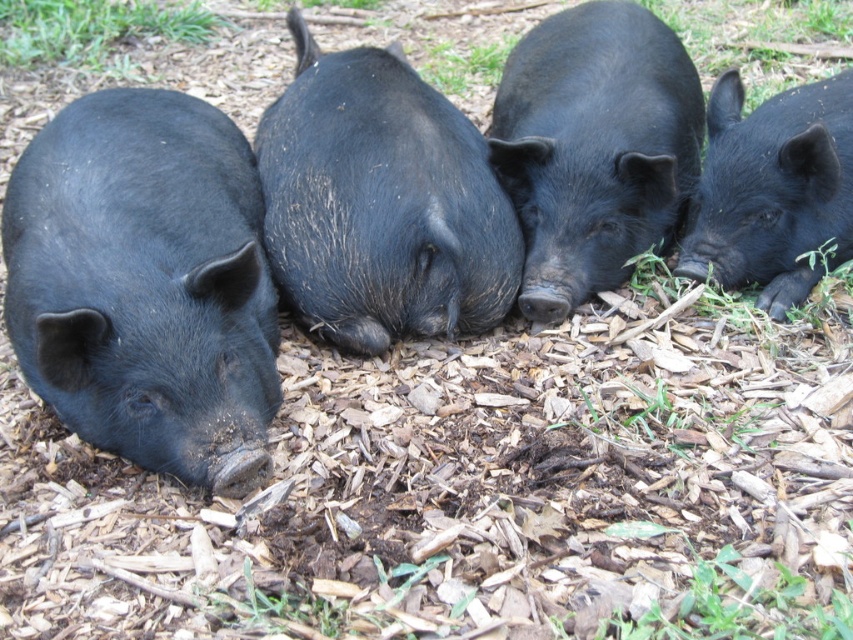
Is matte black pig at left smaller than black rough skin pig at center?

Yes.

Does point (35, 163) come in front of point (360, 241)?

Yes, point (35, 163) is closer to viewer.

This screenshot has height=640, width=853. Find the location of `matte black pig at left`. matte black pig at left is located at coordinates (146, 284).

Does black rough skin pig at center appear on the left side of black matte pig at right?

Indeed, black rough skin pig at center is positioned on the left side of black matte pig at right.

Between point (392, 224) and point (805, 154), which one is positioned in front?

Point (392, 224)

Is point (402, 211) positioned after point (756, 147)?

No, it is in front of (756, 147).

Find the location of a particular element. The image size is (853, 640). black rough skin pig at center is located at coordinates (381, 202).

Does matte black pig at left have a lesser width compared to green grass at upper left?

Yes, matte black pig at left is thinner than green grass at upper left.

Between matte black pig at left and green grass at upper left, which one is positioned higher?

green grass at upper left is above.

Where is `matte black pig at left`? matte black pig at left is located at coordinates (146, 284).

Find the location of a particular element. matte black pig at left is located at coordinates [146, 284].